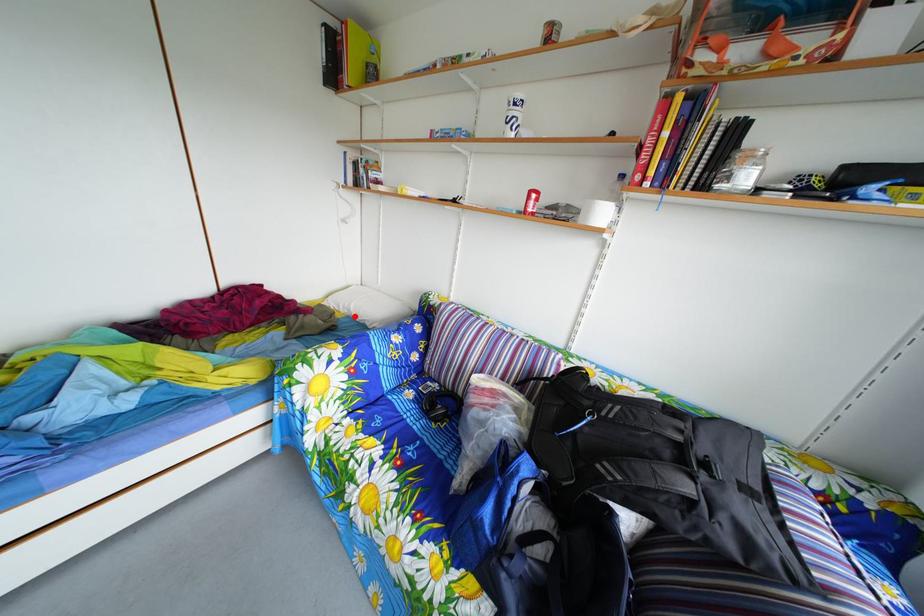
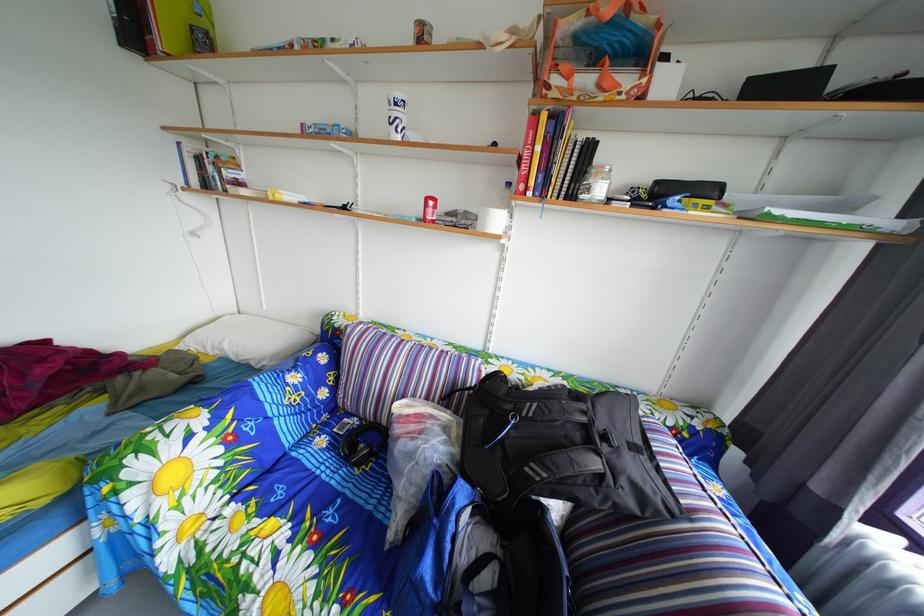
Question: I am providing you with two images of the same scene from different viewpoints. A red point is shown in image1. For the corresponding object point in image2, is it positioned nearer or farther from the camera?

Choices:
 (A) Nearer
 (B) Farther

Answer: (B)